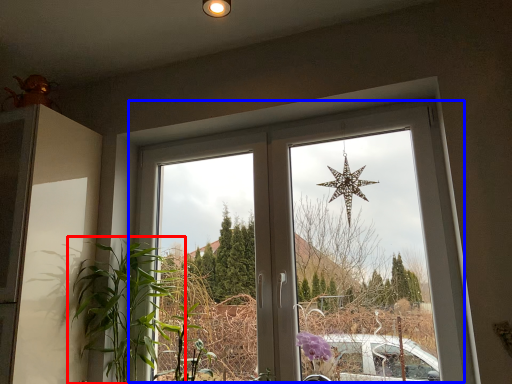
Question: Among these objects, which one is farthest to the camera, houseplant (highlighted by a red box) or window (highlighted by a blue box)?

Choices:
 (A) houseplant
 (B) window

Answer: (A)